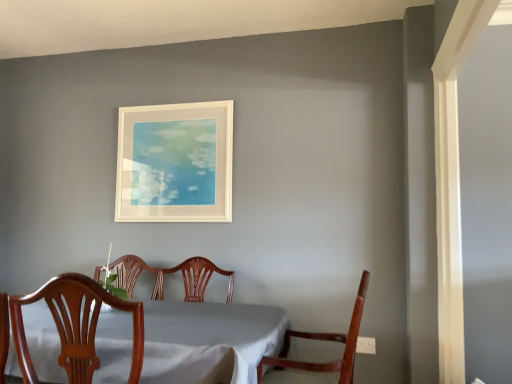
Locate an element on the screen. This screenshot has height=384, width=512. free space above white matte picture frame at upper center (from a real-world perspective) is located at coordinates tap(185, 96).